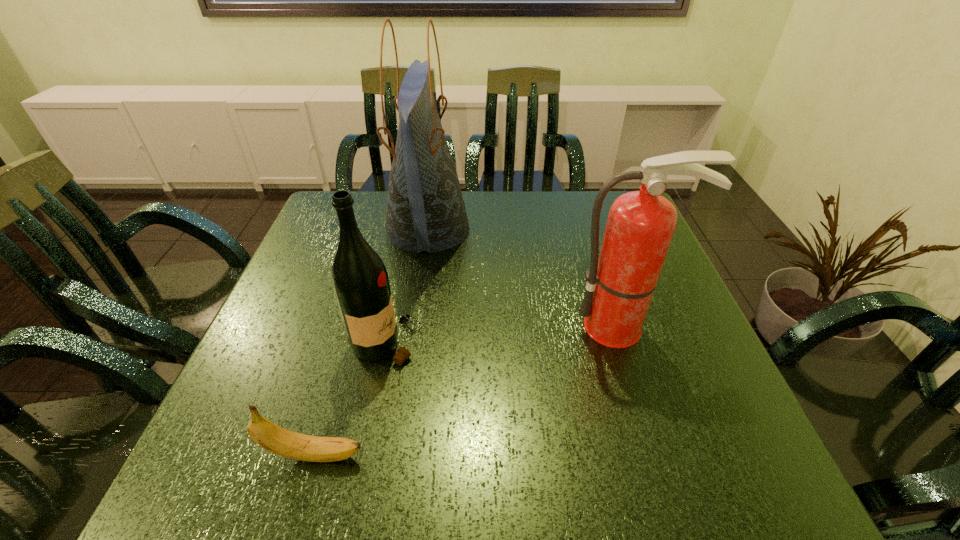
This screenshot has height=540, width=960. What are the coordinates of `empty space between the wine bottle and the rightmost object` in the screenshot? It's located at (503, 335).

Image resolution: width=960 pixels, height=540 pixels. I want to click on vacant region between the wine bottle and the banana, so click(x=351, y=399).

The height and width of the screenshot is (540, 960). Find the location of `free space between the rightmost object and the wine bottle`. free space between the rightmost object and the wine bottle is located at coordinates (503, 335).

Locate an element on the screen. This screenshot has height=540, width=960. vacant space that's between the fire extinguisher and the farthest object is located at coordinates (524, 278).

Find the location of a particular element. The width and height of the screenshot is (960, 540). free space between the wine bottle and the shopping bag is located at coordinates (407, 286).

The height and width of the screenshot is (540, 960). Find the location of `vacant region between the tallest object and the wine bottle`. vacant region between the tallest object and the wine bottle is located at coordinates (407, 286).

This screenshot has height=540, width=960. I want to click on vacant region between the shortest object and the rightmost object, so click(468, 391).

The image size is (960, 540). What are the coordinates of `object that is the closest to the fire extinguisher` in the screenshot? It's located at (426, 211).

What are the coordinates of `object that is the third closest to the fire extinguisher` in the screenshot? It's located at (273, 438).

At what (x,y) coordinates should I click in order to perform the action: click on vacant area that satisfies the following two spatial constraints: 1. with the handle and hose on the fire extinguisher; 2. on the surface of the wine bottle. Please return your answer as a coordinate pair (x, y). The image size is (960, 540). Looking at the image, I should click on (626, 343).